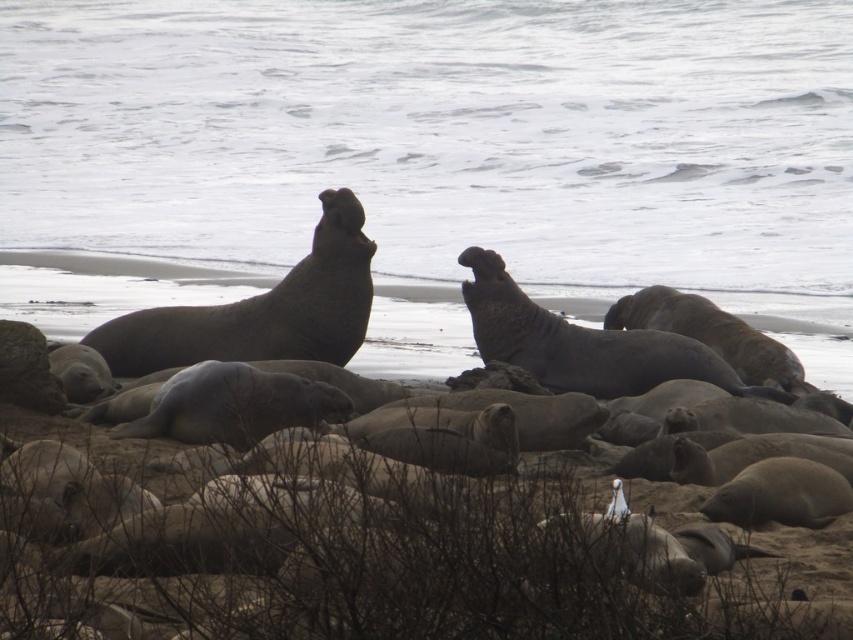
Question: From the image, what is the correct spatial relationship of gray textured seal at center in relation to gray matte seal at center?

Choices:
 (A) above
 (B) below

Answer: (B)

Question: Estimate the real-world distances between objects in this image. Which object is farther from the gray matte seal at center?

Choices:
 (A) gray matte seal at upper left
 (B) gray textured seal at center
 (C) brown sandy beach at center

Answer: (A)

Question: Is brown sandy beach at center wider than gray matte seal at upper left?

Choices:
 (A) no
 (B) yes

Answer: (B)

Question: Among these objects, which one is nearest to the camera?

Choices:
 (A) gray textured seal at center
 (B) brown sandy beach at center

Answer: (B)

Question: Does brown sandy beach at center have a greater width compared to gray matte seal at center?

Choices:
 (A) no
 (B) yes

Answer: (B)

Question: Which point is closer to the camera?

Choices:
 (A) gray matte seal at center
 (B) gray textured seal at center

Answer: (B)